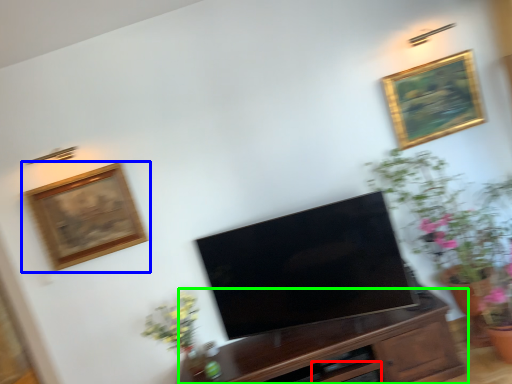
Question: Which object is the farthest from drawer (highlighted by a red box)? Choose among these: picture frame (highlighted by a blue box) or cabinetry (highlighted by a green box).

Choices:
 (A) picture frame
 (B) cabinetry

Answer: (A)